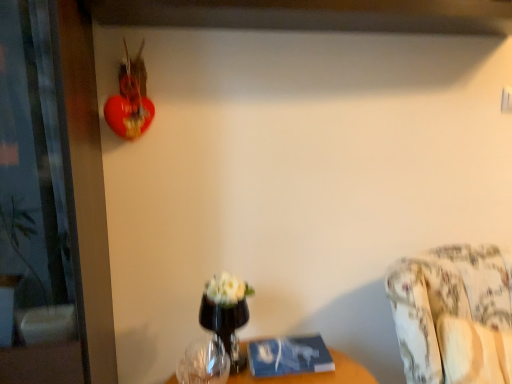
Question: Is transparent glass vase at lower center facing towards transparent glass vase at center?

Choices:
 (A) no
 (B) yes

Answer: (A)

Question: Considering the relative sizes of transparent glass vase at lower center and transparent glass vase at center in the image provided, is transparent glass vase at lower center thinner than transparent glass vase at center?

Choices:
 (A) yes
 (B) no

Answer: (B)

Question: From a real-world perspective, is transparent glass vase at lower center physically below transparent glass vase at center?

Choices:
 (A) yes
 (B) no

Answer: (A)

Question: Does transparent glass vase at lower center lie in front of transparent glass vase at center?

Choices:
 (A) no
 (B) yes

Answer: (B)

Question: Is transparent glass vase at lower center placed right next to transparent glass vase at center?

Choices:
 (A) no
 (B) yes

Answer: (B)

Question: Choose the correct answer: Is transparent glass vase at center inside transparent glass vase at lower center or outside it?

Choices:
 (A) inside
 (B) outside

Answer: (B)

Question: From a real-world perspective, is transparent glass vase at center physically located above or below transparent glass vase at lower center?

Choices:
 (A) above
 (B) below

Answer: (A)

Question: Considering the positions of transparent glass vase at center and transparent glass vase at lower center in the image, is transparent glass vase at center bigger or smaller than transparent glass vase at lower center?

Choices:
 (A) big
 (B) small

Answer: (A)

Question: Considering their positions, is transparent glass vase at center located in front of or behind transparent glass vase at lower center?

Choices:
 (A) front
 (B) behind

Answer: (B)

Question: From a real-world perspective, is transparent glass vase at lower center above or below floral fabric couch at lower right?

Choices:
 (A) below
 (B) above

Answer: (B)

Question: Is point (182, 375) positioned closer to the camera than point (433, 294)?

Choices:
 (A) farther
 (B) closer

Answer: (A)

Question: Based on their positions, is transparent glass vase at lower center located to the left or right of floral fabric couch at lower right?

Choices:
 (A) left
 (B) right

Answer: (A)

Question: In terms of width, does transparent glass vase at lower center look wider or thinner when compared to floral fabric couch at lower right?

Choices:
 (A) wide
 (B) thin

Answer: (B)

Question: Is floral fabric couch at lower right bigger or smaller than transparent glass vase at center?

Choices:
 (A) small
 (B) big

Answer: (B)

Question: Relative to transparent glass vase at center, is floral fabric couch at lower right in front or behind?

Choices:
 (A) behind
 (B) front

Answer: (B)